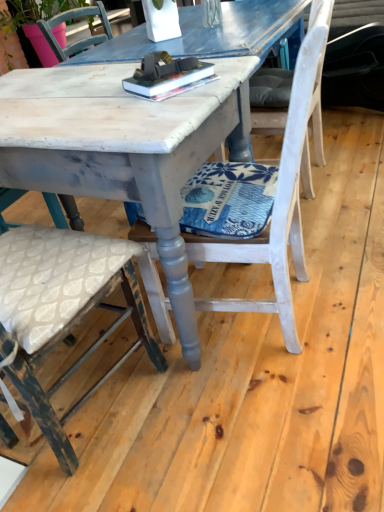
Locate an element on the screen. vacant region to the left of hardcover book at center is located at coordinates (105, 104).